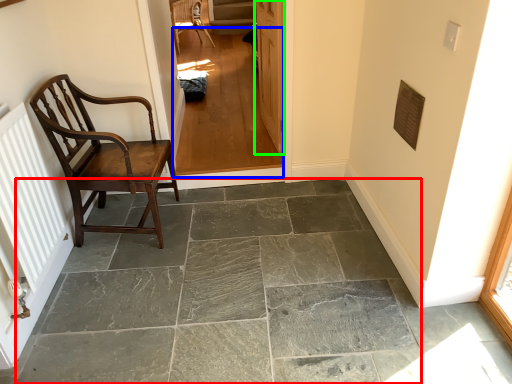
Question: Estimate the real-world distances between objects in this image. Which object is farther from concrete (highlighted by a red box), corridor (highlighted by a blue box) or door (highlighted by a green box)?

Choices:
 (A) corridor
 (B) door

Answer: (B)